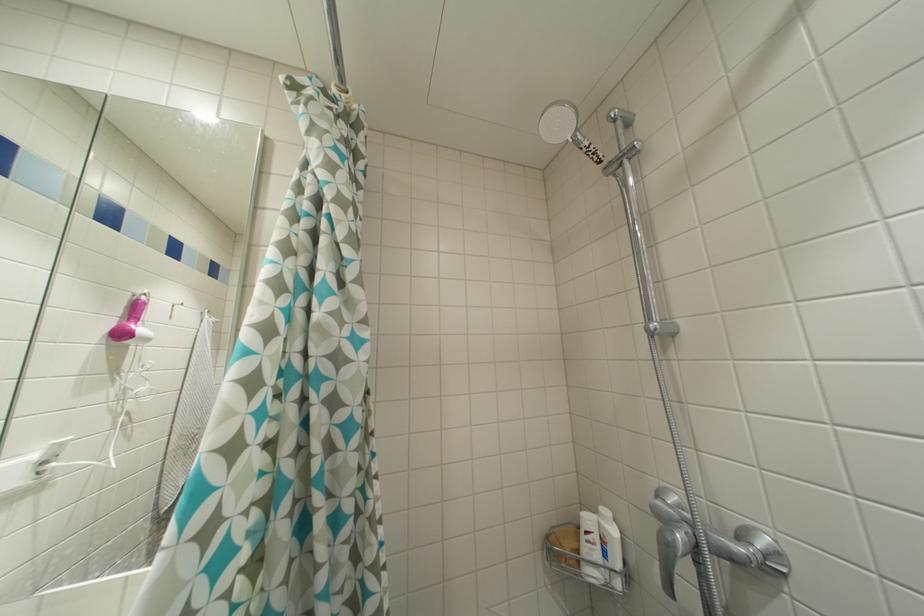
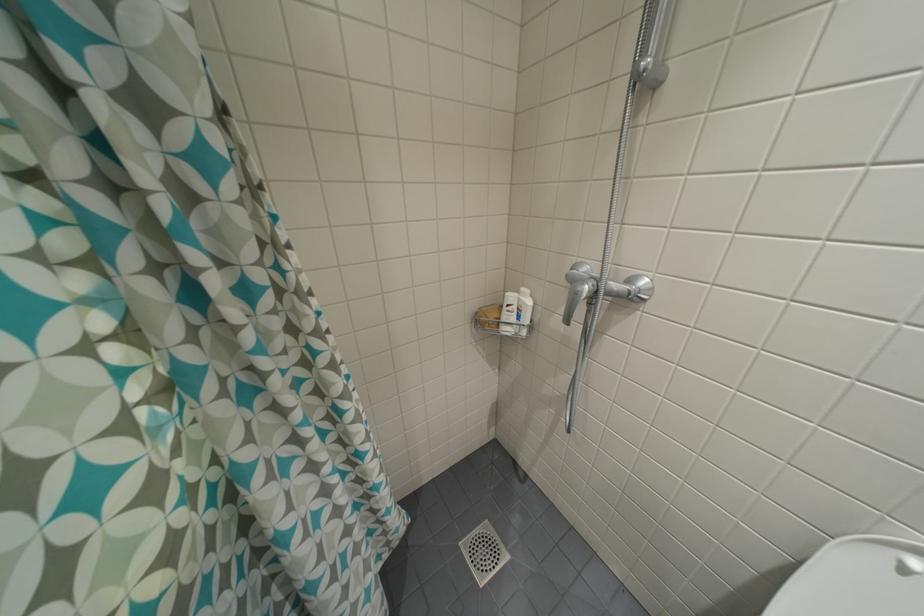
How did the camera likely rotate?

The camera's rotation is toward right-down.